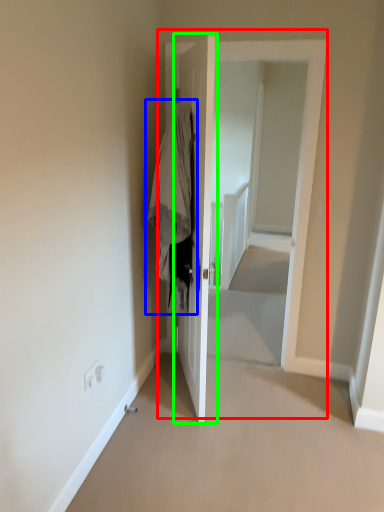
Question: Which is farther away from door (highlighted by a red box)? clothing (highlighted by a blue box) or door (highlighted by a green box)?

Choices:
 (A) clothing
 (B) door

Answer: (A)